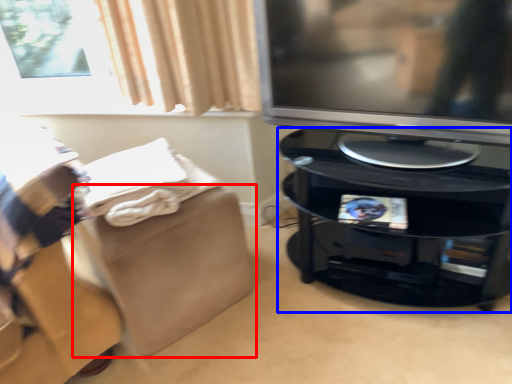
Question: Which object appears farthest to the camera in this image, footrest (highlighted by a red box) or furniture (highlighted by a blue box)?

Choices:
 (A) footrest
 (B) furniture

Answer: (A)